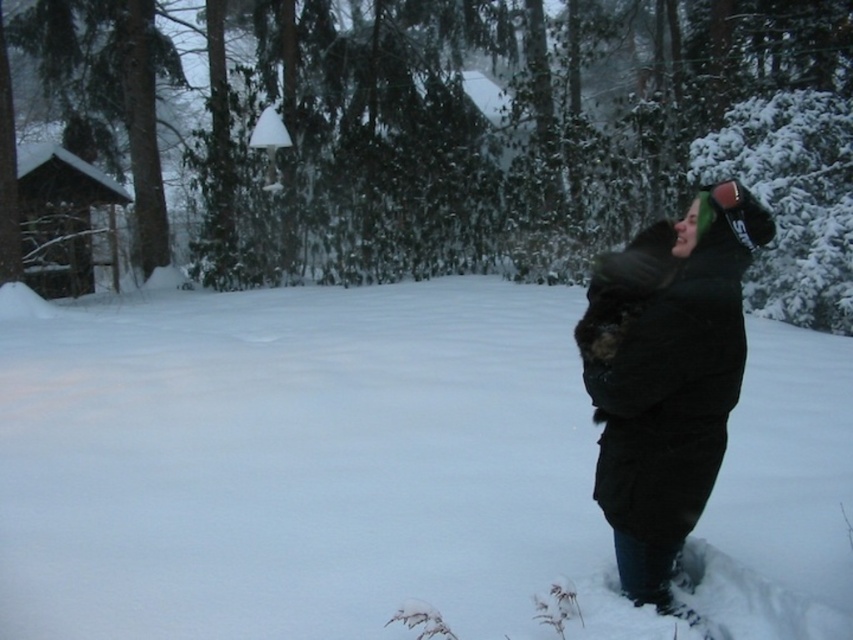
You are standing at the center of a snowy forest clearing. You see a point marked at coordinates (299, 465). What is located at that point?

The point at coordinates (299, 465) indicates white fluffy snow at center.

You are trying to decide whether to sit on the white fluffy snow at center or wear the black fuzzy coat at right. Which option will keep you warmer?

The black fuzzy coat at right will keep you warmer because it is taller than the white fluffy snow at center, providing better insulation.